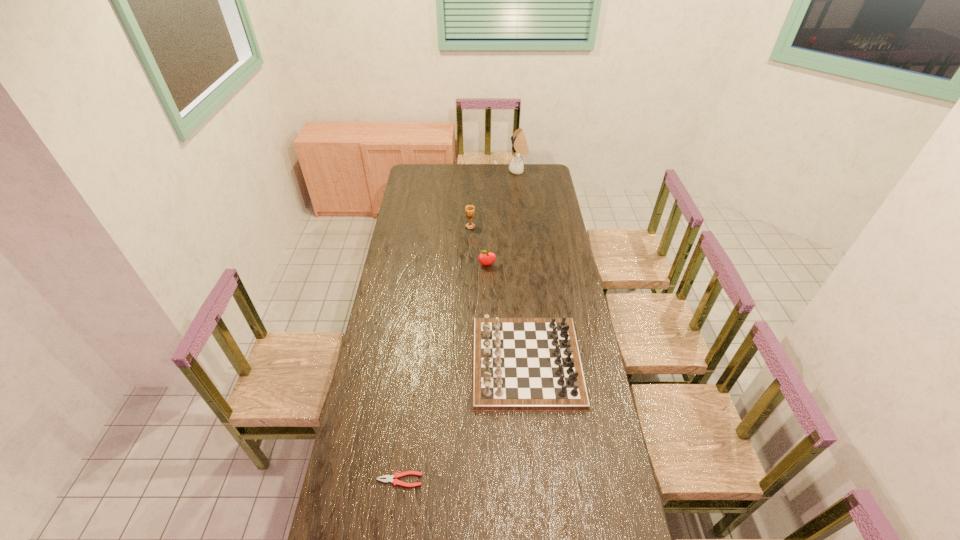
Where is `free point located 0.110m on the left of the second farthest object`? The width and height of the screenshot is (960, 540). free point located 0.110m on the left of the second farthest object is located at coordinates (445, 226).

Locate an element on the screen. The width and height of the screenshot is (960, 540). free space located 0.390m from the player's perspective of the fourth farthest object is located at coordinates (376, 362).

This screenshot has height=540, width=960. Find the location of `free space located from the player's perspective of the fourth farthest object`. free space located from the player's perspective of the fourth farthest object is located at coordinates (411, 362).

Identify the location of vacant area situated 0.110m from the player's perspective of the fourth farthest object. (445, 362).

I want to click on free location located on the back of the apple, so click(x=487, y=226).

You are a GUI agent. You are given a task and a screenshot of the screen. Output one action in this format:
    pyautogui.click(x=<x>, y=<y>)
    Task: Click on the vacant space located 0.060m on the back of the shortest object
    
    Given the screenshot: What is the action you would take?
    pyautogui.click(x=403, y=454)

Where is `object located in the far edge section of the desktop`? This screenshot has width=960, height=540. object located in the far edge section of the desktop is located at coordinates (519, 144).

You are a GUI agent. You are given a task and a screenshot of the screen. Output one action in this format:
    pyautogui.click(x=<x>, y=<y>)
    Task: Click on the object situated at the left edge
    The height and width of the screenshot is (540, 960).
    Given the screenshot: What is the action you would take?
    pyautogui.click(x=389, y=478)

Where is `doll present at the right edge`? The width and height of the screenshot is (960, 540). doll present at the right edge is located at coordinates (519, 144).

In order to click on chessboard present at the right edge in this screenshot , I will do `click(518, 364)`.